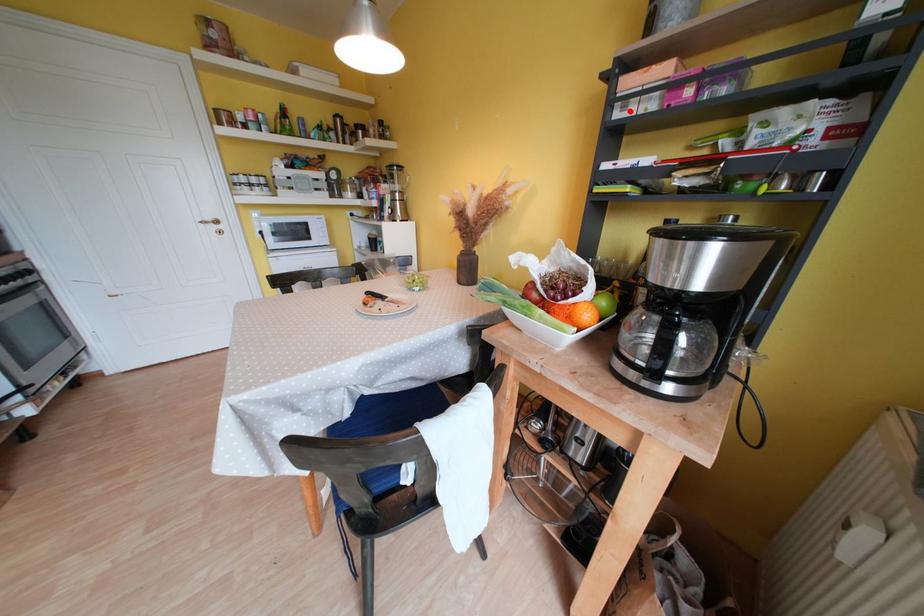
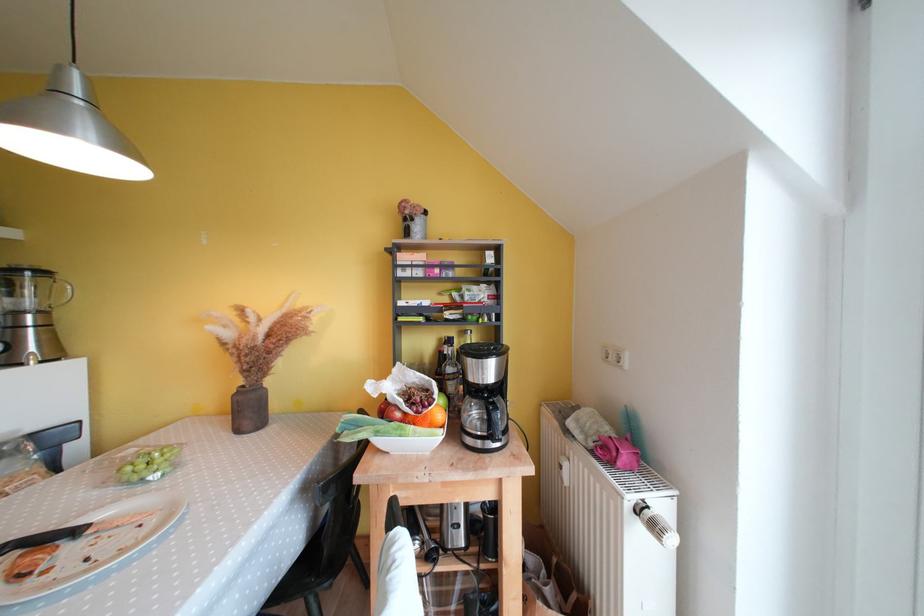
Locate, in the second image, the point that corresponds to the highlighted location in the first image.

(409, 274)